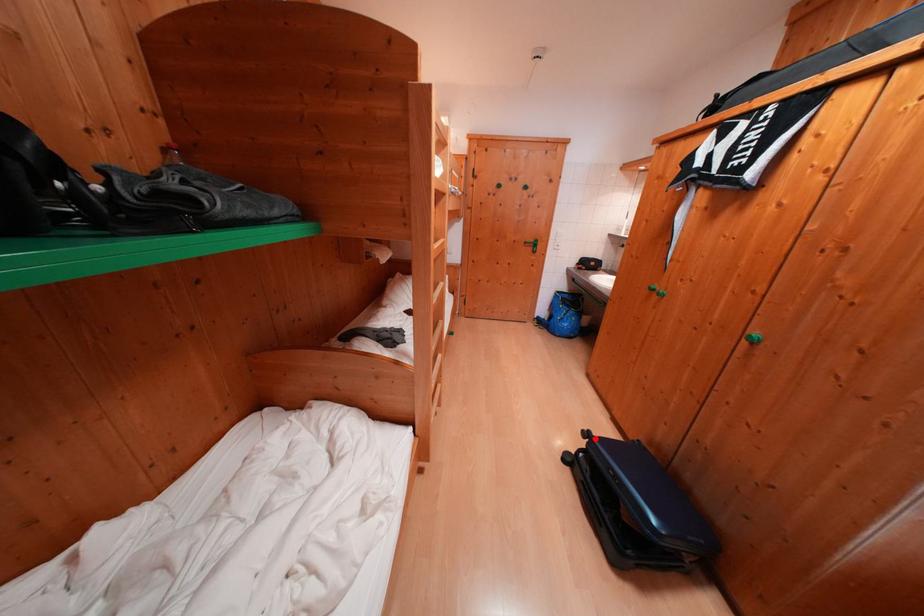
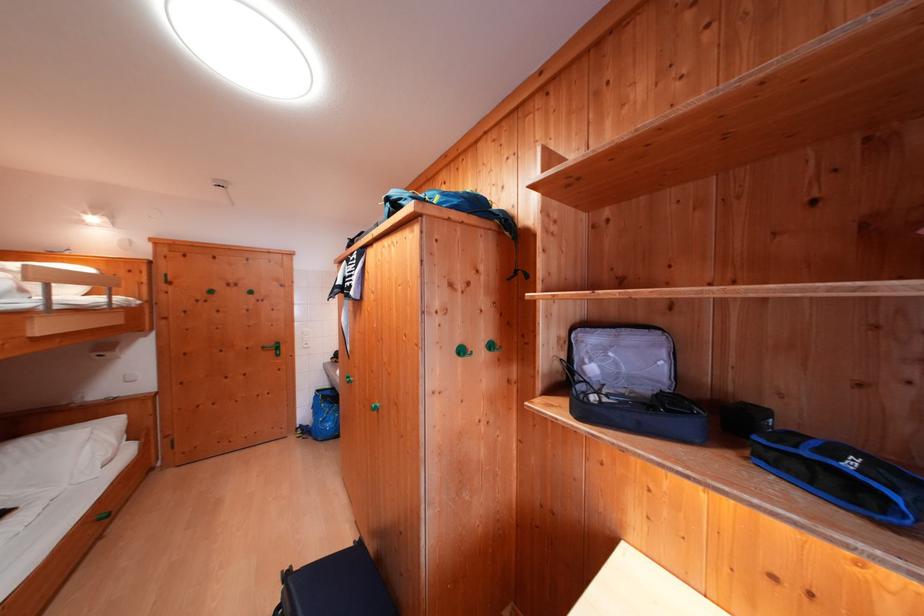
Locate, in the second image, the point that corresponds to the highlighted location in the first image.

(296, 578)